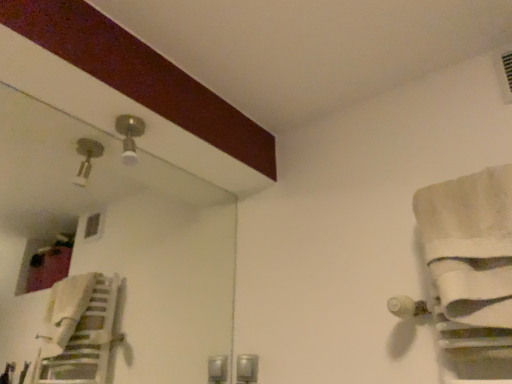
Question: Would you say matte silver light fixture at upper center is inside or outside white cotton bath towel at right?

Choices:
 (A) outside
 (B) inside

Answer: (A)

Question: Is point (135, 127) closer or farther from the camera than point (481, 294)?

Choices:
 (A) farther
 (B) closer

Answer: (A)

Question: Is matte silver light fixture at upper center in front of or behind white cotton bath towel at right in the image?

Choices:
 (A) behind
 (B) front

Answer: (A)

Question: From a real-world perspective, is white cotton bath towel at right physically located above or below matte silver light fixture at upper center?

Choices:
 (A) above
 (B) below

Answer: (B)

Question: Is white cotton bath towel at right bigger or smaller than matte silver light fixture at upper center?

Choices:
 (A) big
 (B) small

Answer: (A)

Question: Is point (498, 279) positioned closer to the camera than point (126, 155)?

Choices:
 (A) closer
 (B) farther

Answer: (A)

Question: Is white cotton bath towel at right taller or shorter than matte silver light fixture at upper center?

Choices:
 (A) short
 (B) tall

Answer: (B)